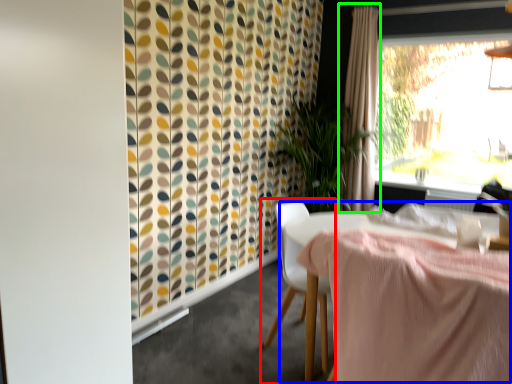
Question: Which object is the farthest from chair (highlighted by a red box)? Choose among these: table (highlighted by a blue box) or curtain (highlighted by a green box).

Choices:
 (A) table
 (B) curtain

Answer: (B)